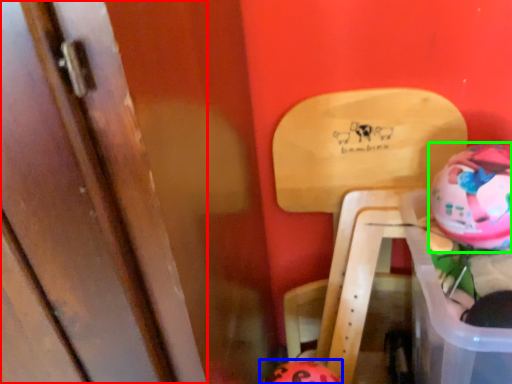
Question: Based on their relative distances, which object is farther from door (highlighted by a red box)? Choose from piggy bank (highlighted by a blue box) and piggy bank (highlighted by a green box).

Choices:
 (A) piggy bank
 (B) piggy bank

Answer: (B)